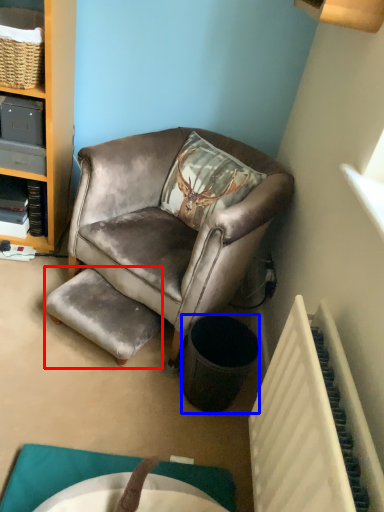
Question: Which object appears closest to the camera in this image, stool (highlighted by a red box) or trash bin/can (highlighted by a blue box)?

Choices:
 (A) stool
 (B) trash bin/can

Answer: (B)